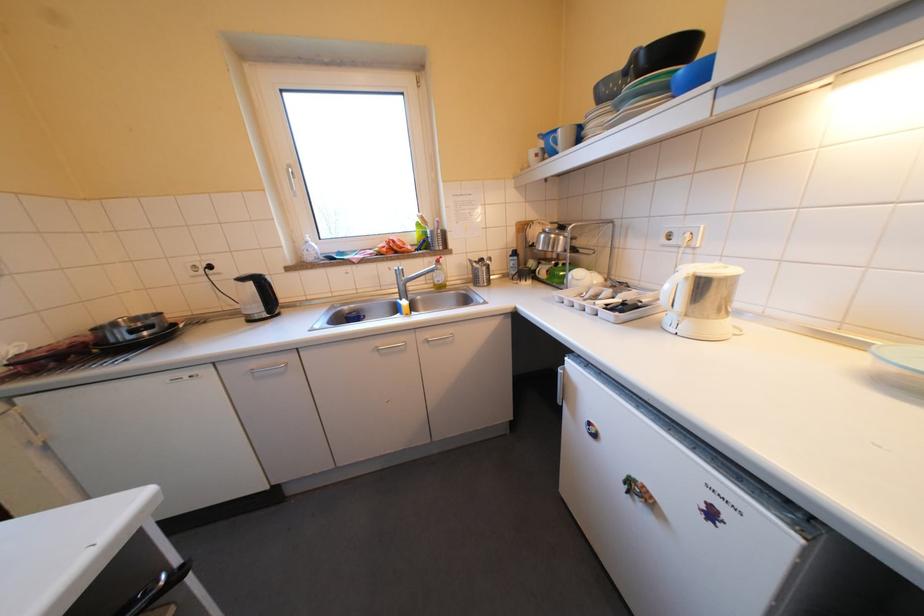
This screenshot has width=924, height=616. Find the location of `white window handle`. white window handle is located at coordinates (290, 175).